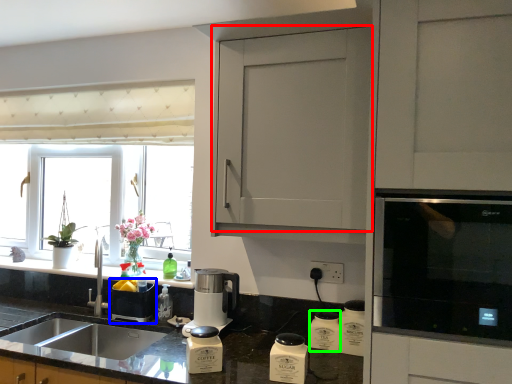
Question: Which object is the closest to the cabinetry (highlighted by a red box)? Choose among these: appliance (highlighted by a blue box) or appliance (highlighted by a green box).

Choices:
 (A) appliance
 (B) appliance

Answer: (B)